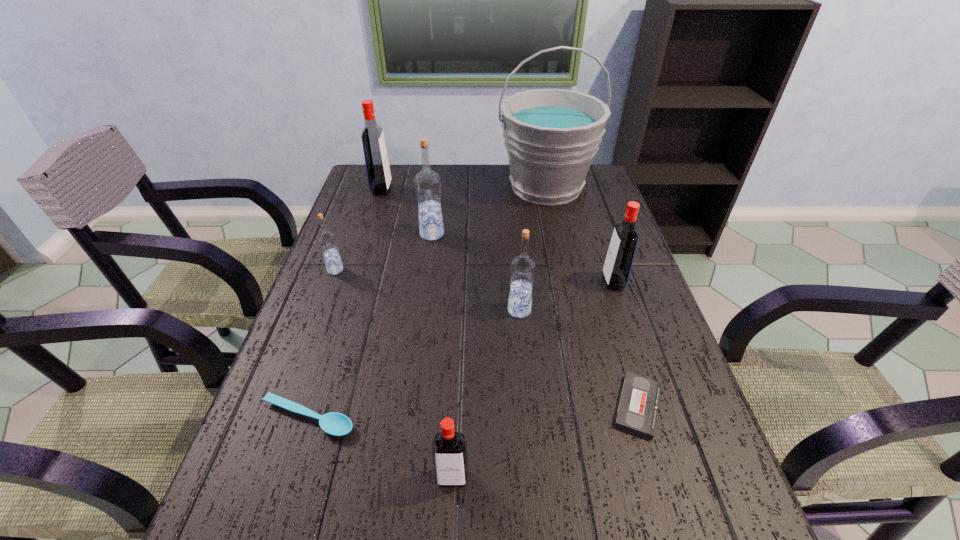
You are a GUI agent. You are given a task and a screenshot of the screen. Output one action in this format:
    pyautogui.click(x=<x>, y=<y>)
    Task: Click on the vacant point located between the tallest object and the second vodka from left to right
    This screenshot has width=960, height=540.
    Given the screenshot: What is the action you would take?
    pyautogui.click(x=464, y=188)

Where is `free spot between the rightmost vodka and the spoon`? This screenshot has height=540, width=960. free spot between the rightmost vodka and the spoon is located at coordinates (461, 350).

This screenshot has height=540, width=960. Identify the location of free space that is in between the leftmost blue vodka and the second nearest red vodka. (474, 276).

The width and height of the screenshot is (960, 540). Identify the location of free space between the second farthest vodka and the farthest red vodka. (407, 212).

This screenshot has height=540, width=960. I want to click on vacant area that lies between the blue bucket and the second vodka from left to right, so click(464, 188).

Find the location of a particular element. This screenshot has height=540, width=960. free space between the leftmost vodka and the farthest vodka is located at coordinates (358, 230).

Identify the location of free space between the seventh nearest object and the fifth vodka from left to right. This screenshot has height=540, width=960. [x=476, y=272].

You are a GUI agent. You are given a task and a screenshot of the screen. Output one action in this format:
    pyautogui.click(x=<x>, y=<y>)
    Task: Click on the unoccupied position between the second vodka from right to left and the shortest object
    The width and height of the screenshot is (960, 540).
    Given the screenshot: What is the action you would take?
    pyautogui.click(x=579, y=358)

At what (x,y) coordinates should I click in order to perform the action: click on the seventh closest object to the farthest blue vodka. Please return your answer as a coordinate pair (x, y). Looking at the image, I should click on (637, 412).

The image size is (960, 540). Identify the location of the fifth closest object to the tallest object. (327, 241).